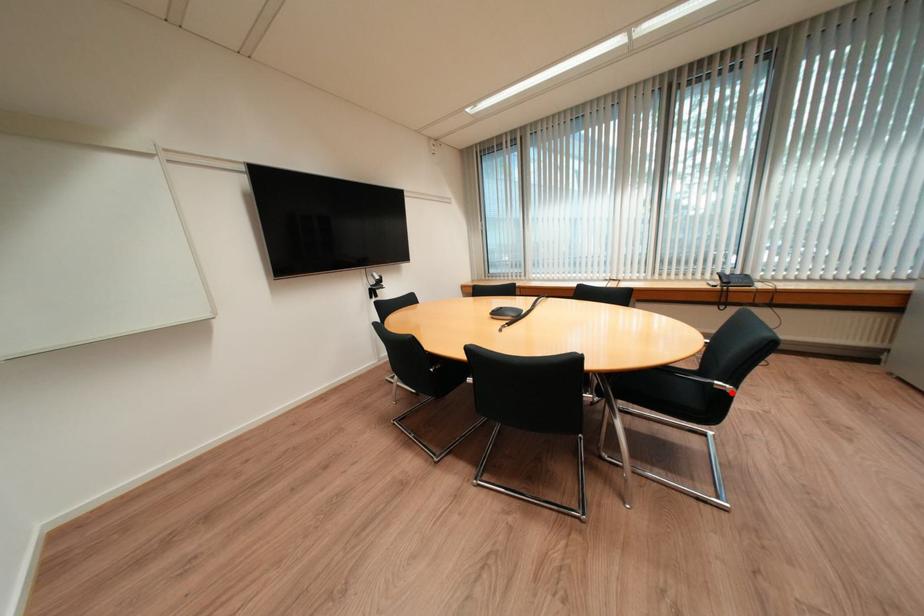
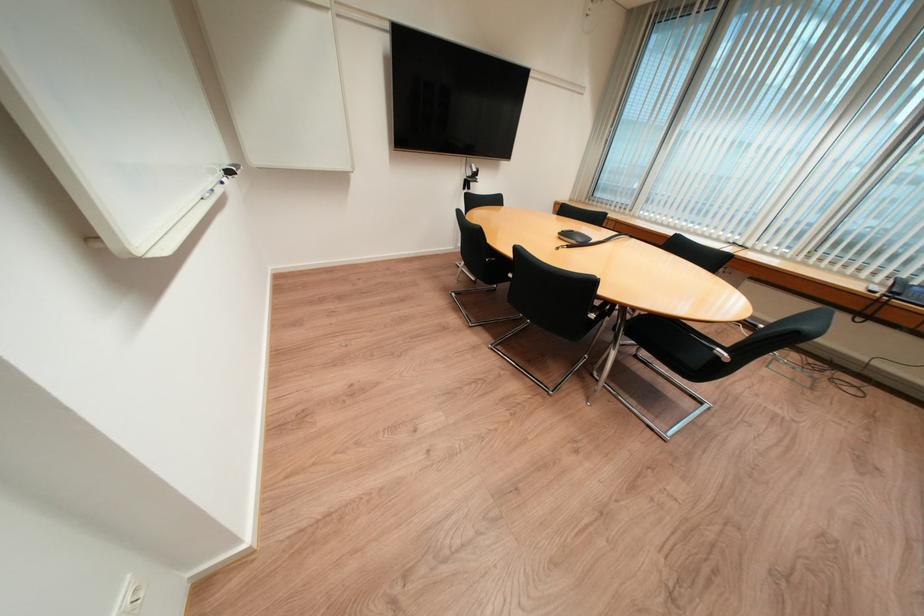
Where in the second image is the point corresponding to the highlighted location from the first image?

(725, 359)